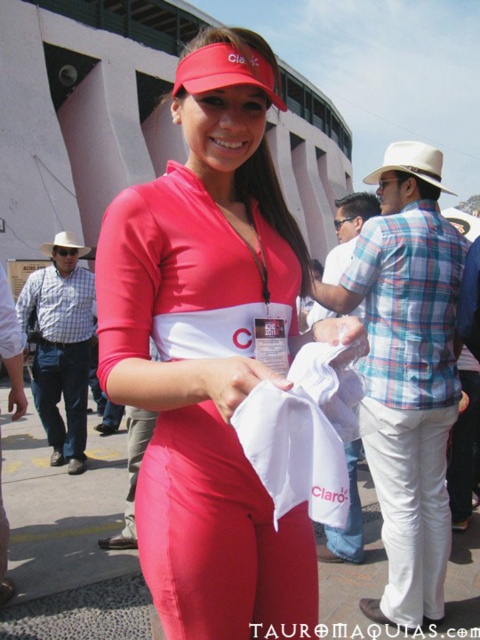
From the picture: You are a photographer at the event and need to position yourself so that the matte red uniform at center and the beige straw hat at upper right are both visible in your shot. Based on their positions, which object should you ensure is on the left side of the frame?

The matte red uniform at center should be on the left side of the frame because it is positioned to the left of the beige straw hat at upper right.

You are at the event and want to take a photo of both point (312, 618) and point (62, 234) in the image. Which point should you focus on first to ensure both are in focus?

You should focus on point (62, 234) first because it is farther from the camera than point (312, 618). By focusing on the farther point, the closer point will also be within the depth of field.

You are a photographer positioned at the front of the event. You need to capture a clear shot of both the matte red uniform at center and the beige straw hat at upper right. However, your camera can only focus on objects at a single distance. Which object should you focus on to ensure at least one of them is in focus?

You should focus on the matte red uniform at center because it is closer to the viewer than the beige straw hat at upper right, so focusing on it increases the chance of it being in focus while the hat may still be partially in focus depending on the depth of field.